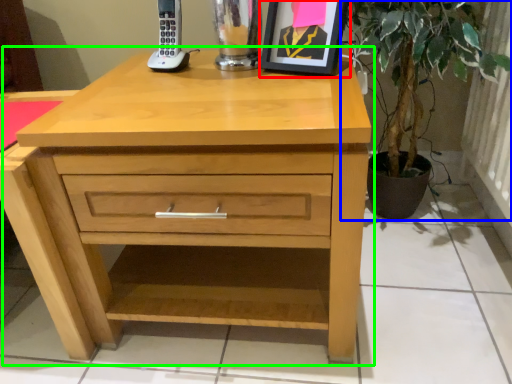
Question: Which object is positioned farthest from picture frame (highlighted by a red box)? Select from houseplant (highlighted by a blue box) and chest of drawers (highlighted by a green box).

Choices:
 (A) houseplant
 (B) chest of drawers

Answer: (B)